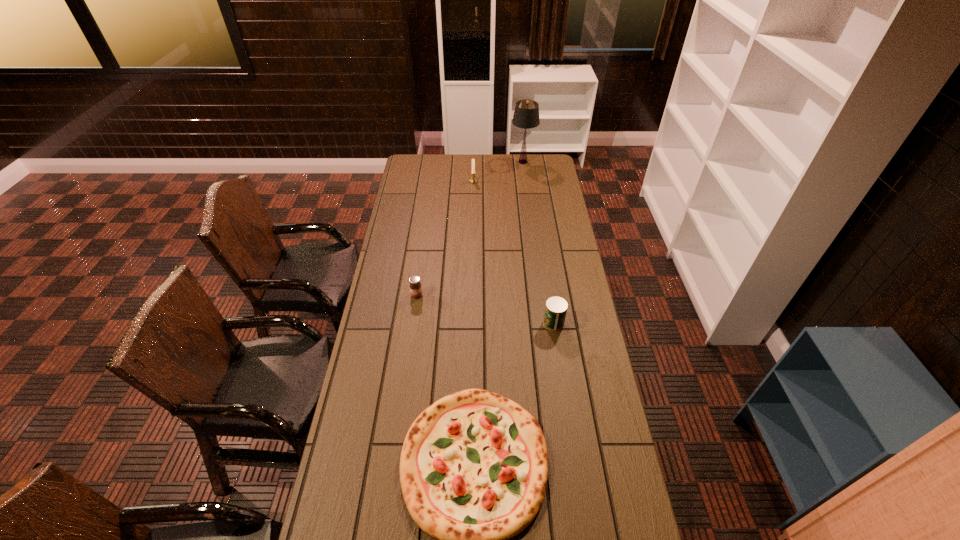
At what (x,y) coordinates should I click in order to perform the action: click on blank space located on the front-facing side of the tallest object. Please return your answer as a coordinate pair (x, y). The height and width of the screenshot is (540, 960). Looking at the image, I should click on (498, 162).

Where is `blank space located on the front of the second tallest object`? Image resolution: width=960 pixels, height=540 pixels. blank space located on the front of the second tallest object is located at coordinates (473, 201).

Locate an element on the screen. This screenshot has width=960, height=540. vacant area situated 0.400m on the left of the fourth farthest object is located at coordinates (442, 323).

Locate an element on the screen. vacant space located on the label side of the third nearest object is located at coordinates (413, 322).

Find the location of a particular element. object at the far edge is located at coordinates (526, 114).

Where is `object present at the left edge`? The height and width of the screenshot is (540, 960). object present at the left edge is located at coordinates (415, 286).

Where is `lampshade present at the right edge`? This screenshot has height=540, width=960. lampshade present at the right edge is located at coordinates (526, 114).

The width and height of the screenshot is (960, 540). What are the coordinates of `can at the right edge` in the screenshot? It's located at tap(556, 307).

Identify the location of object at the far right corner. (526, 114).

Find the location of `free region at the left edge of the desktop`. free region at the left edge of the desktop is located at coordinates (419, 199).